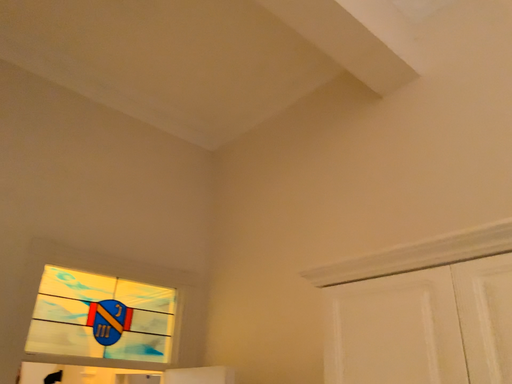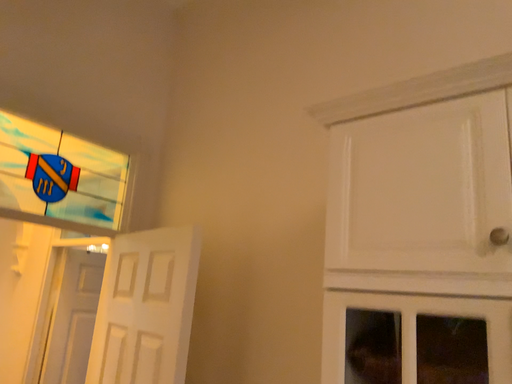
Question: How did the camera likely rotate when shooting the video?

Choices:
 (A) rotated right
 (B) rotated left

Answer: (A)